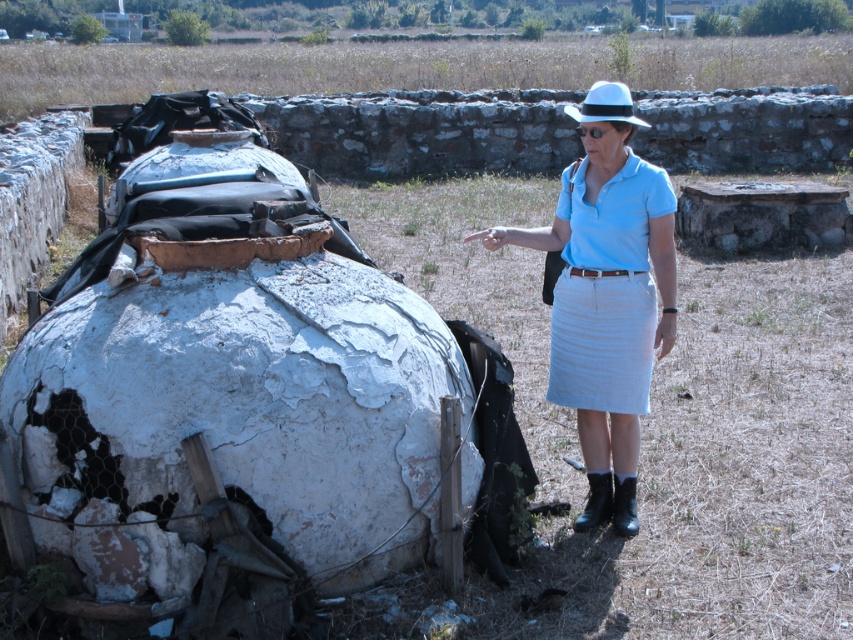
You are a fashion designer observing the woman in the image. You notice she is wearing a light blue cotton shirt at center and a light blue cotton skirt at right. Which piece of clothing is closer to the bottom of her body?

The light blue cotton skirt at right is closer to the bottom of her body because the light blue cotton shirt at center is positioned under it.

You are standing in front of the large weathered spherical structure and want to move from the point marked as point (x=584, y=397) to the point marked as point (x=612, y=198). Which direction should you move to get closer to the structure?

To move from point (x=584, y=397) to point (x=612, y=198) and get closer to the structure, you should move towards the point (x=612, y=198) since it is closer to the structure than point (x=584, y=397).